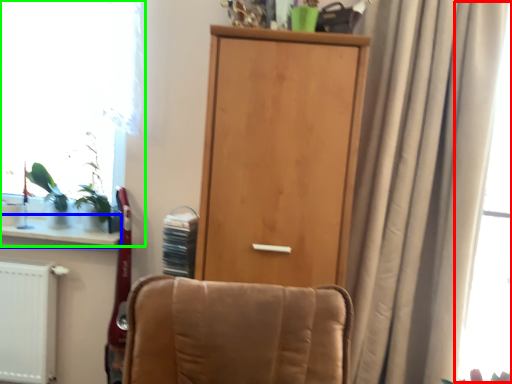
Question: Estimate the real-world distances between objects in this image. Which object is closer to window screen (highlighted by a red box), window sill (highlighted by a blue box) or window (highlighted by a green box)?

Choices:
 (A) window sill
 (B) window

Answer: (B)